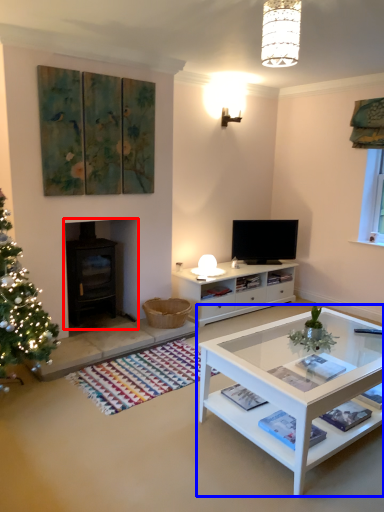
Question: Among these objects, which one is nearest to the camera, fireplace (highlighted by a red box) or coffee table (highlighted by a blue box)?

Choices:
 (A) fireplace
 (B) coffee table

Answer: (B)